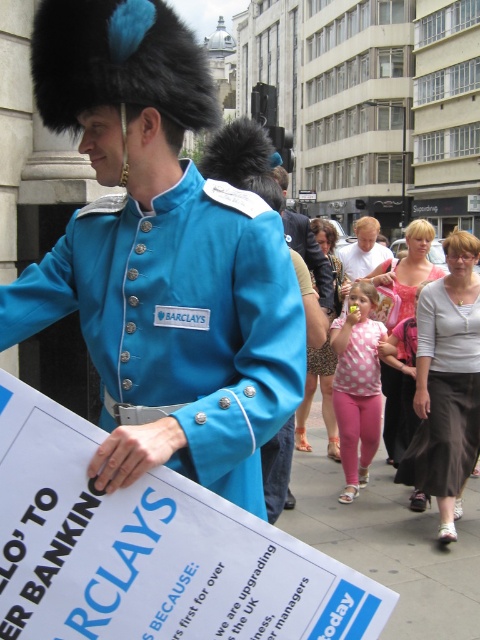
Question: Among these objects, which one is farthest from the camera?

Choices:
 (A) light brown hair at center
 (B) matte blue fabric uniform at center
 (C) pink fabric dress at center

Answer: (A)

Question: Is matte blue fabric uniform at center in front of pink polka dot leggings at center?

Choices:
 (A) yes
 (B) no

Answer: (A)

Question: Is leopard print dress at center thinner than light brown hair at center?

Choices:
 (A) no
 (B) yes

Answer: (B)

Question: Which is farther from the pink polka dot leggings at center?

Choices:
 (A) pink fabric dress at center
 (B) pink fabric at lower center
 (C) light brown hair at center
 (D) light gray cotton skirt at lower right

Answer: (C)

Question: Observing the image, what is the correct spatial positioning of pink polka dot leggings at center in reference to leopard print dress at center?

Choices:
 (A) right
 (B) left

Answer: (A)

Question: Which of the following is the farthest from the observer?

Choices:
 (A) (300, 508)
 (B) (355, 268)
 (C) (359, 321)
 (D) (433, 426)

Answer: (B)